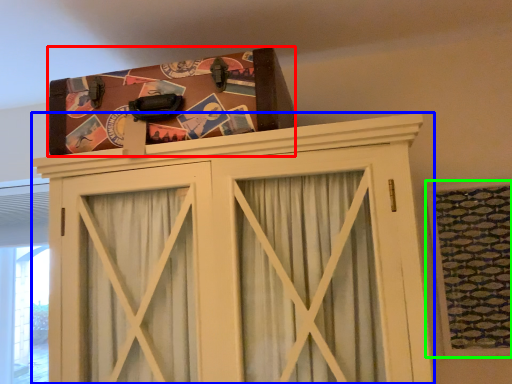
Question: Considering the real-world distances, which object is farthest from package (highlighted by a red box)? cupboard (highlighted by a blue box) or window (highlighted by a green box)?

Choices:
 (A) cupboard
 (B) window

Answer: (B)